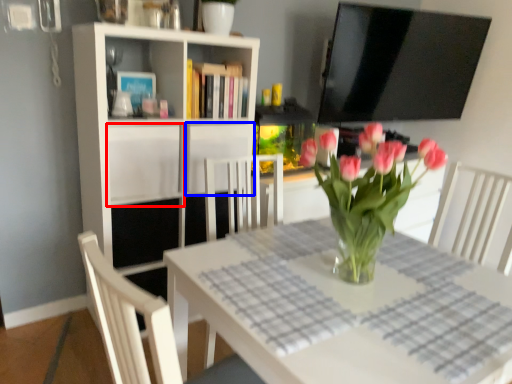
Question: Which object is further to the camera taking this photo, cabinet (highlighted by a red box) or cabinet (highlighted by a blue box)?

Choices:
 (A) cabinet
 (B) cabinet

Answer: (B)